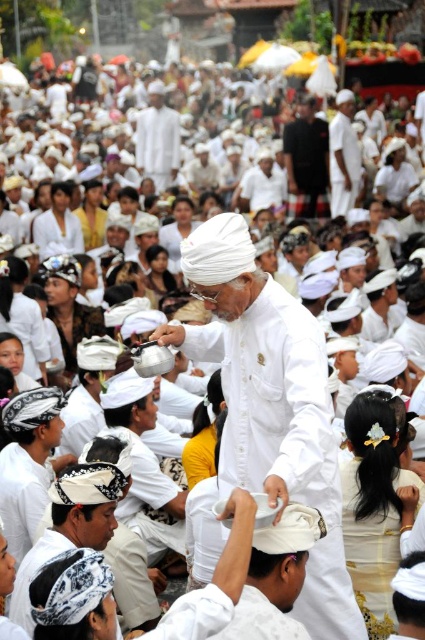
Describe the element at coordinates (70, 525) in the screenshot. I see `white woven turban at center` at that location.

Is point (48, 541) farther from viewer compared to point (331, 180)?

No, it is in front of (331, 180).

Between point (93, 547) and point (334, 156), which one is positioned in front?

Positioned in front is point (93, 547).

What are the coordinates of `white woven turban at center` in the screenshot? It's located at (70, 525).

Can you confirm if black matte shirt at center is taller than white cotton turban at center?

No, black matte shirt at center is not taller than white cotton turban at center.

Can you confirm if black matte shirt at center is positioned above white cotton turban at center?

No, black matte shirt at center is not above white cotton turban at center.

Locate an element on the screen. black matte shirt at center is located at coordinates (306, 156).

Image resolution: width=425 pixels, height=640 pixels. Describe the element at coordinates (271, 403) in the screenshot. I see `white matte shirt at center` at that location.

The image size is (425, 640). I want to click on white matte shirt at center, so click(x=271, y=403).